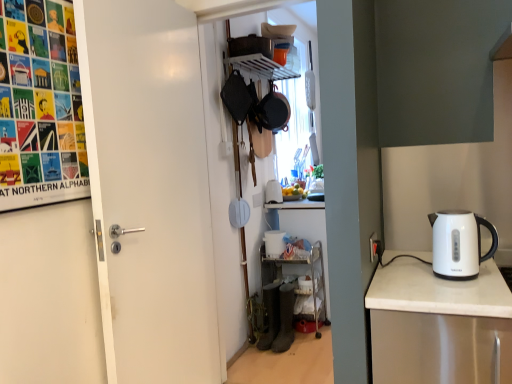
Question: From a real-world perspective, is white matte door at left positioned under metallic silver shelf at lower center, the first shelf when ordered from bottom to top, based on gravity?

Choices:
 (A) yes
 (B) no

Answer: (B)

Question: Is white matte door at left thinner than metallic silver shelf at lower center, the first shelf when ordered from bottom to top?

Choices:
 (A) yes
 (B) no

Answer: (A)

Question: Is white matte door at left wider than metallic silver shelf at lower center, which is counted as the 2th shelf, starting from the top?

Choices:
 (A) no
 (B) yes

Answer: (A)

Question: Is white matte door at left not near metallic silver shelf at lower center, the first shelf when ordered from bottom to top?

Choices:
 (A) no
 (B) yes

Answer: (B)

Question: Is metallic silver shelf at lower center, which is counted as the 2th shelf, starting from the top, at the back of white matte door at left?

Choices:
 (A) yes
 (B) no

Answer: (B)

Question: From the image's perspective, is white plastic bucket at lower center, which is counted as the second appliance, starting from the back, above or below matte black frying pan at upper center?

Choices:
 (A) above
 (B) below

Answer: (B)

Question: In the image, is white plastic bucket at lower center, marked as the 2th appliance in a top-to-bottom arrangement, on the left side or the right side of matte black frying pan at upper center?

Choices:
 (A) right
 (B) left

Answer: (A)

Question: Is white plastic bucket at lower center, the 2th appliance positioned from the bottom, in front of or behind matte black frying pan at upper center in the image?

Choices:
 (A) behind
 (B) front

Answer: (B)

Question: In terms of height, does white plastic bucket at lower center, which is counted as the second appliance, starting from the back, look taller or shorter compared to matte black frying pan at upper center?

Choices:
 (A) tall
 (B) short

Answer: (B)

Question: From the image's perspective, is metallic silver shelf at lower center, which is counted as the 2th shelf, starting from the top, located above or below white glossy electric kettle at right?

Choices:
 (A) above
 (B) below

Answer: (B)

Question: Looking at the image, does metallic silver shelf at lower center, the first shelf when ordered from bottom to top, seem bigger or smaller compared to white glossy electric kettle at right?

Choices:
 (A) big
 (B) small

Answer: (A)

Question: From their relative heights in the image, would you say metallic silver shelf at lower center, which is counted as the 2th shelf, starting from the top, is taller or shorter than white glossy electric kettle at right?

Choices:
 (A) short
 (B) tall

Answer: (B)

Question: Looking at their shapes, would you say metallic silver shelf at lower center, which is counted as the 2th shelf, starting from the top, is wider or thinner than white glossy electric kettle at right?

Choices:
 (A) wide
 (B) thin

Answer: (A)

Question: Is matte black kettle at lower center, the 1th appliance when ordered from bottom to top, inside the boundaries of white plastic shelf at upper center, marked as the second shelf in a bottom-to-top arrangement, or outside?

Choices:
 (A) outside
 (B) inside

Answer: (A)

Question: From the image's perspective, is matte black kettle at lower center, the 3th appliance in the back-to-front sequence, positioned above or below white plastic shelf at upper center, the 1th shelf from the top?

Choices:
 (A) above
 (B) below

Answer: (B)